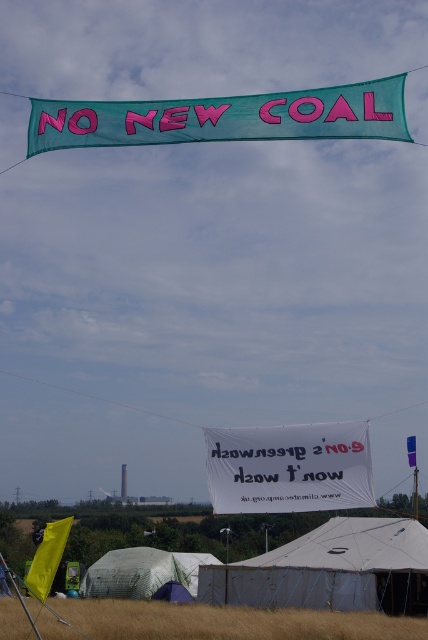
Question: Which point appears farthest from the camera in this image?

Choices:
 (A) (184, 624)
 (B) (35, 100)
 (C) (134, 589)

Answer: (C)

Question: Can you confirm if white fabric tent at lower center is bigger than transparent plastic tent at lower center?

Choices:
 (A) no
 (B) yes

Answer: (B)

Question: Does brown grass at lower center appear under transparent plastic tent at lower center?

Choices:
 (A) yes
 (B) no

Answer: (B)

Question: Can you confirm if white fabric tent at lower center is bigger than white fabric banner at center?

Choices:
 (A) no
 (B) yes

Answer: (B)

Question: Among these points, which one is nearest to the camera?

Choices:
 (A) (151, 557)
 (B) (388, 118)

Answer: (B)

Question: Which point is closer to the camera taking this photo?

Choices:
 (A) coord(326,433)
 (B) coord(415,580)
 (C) coord(186,579)

Answer: (A)